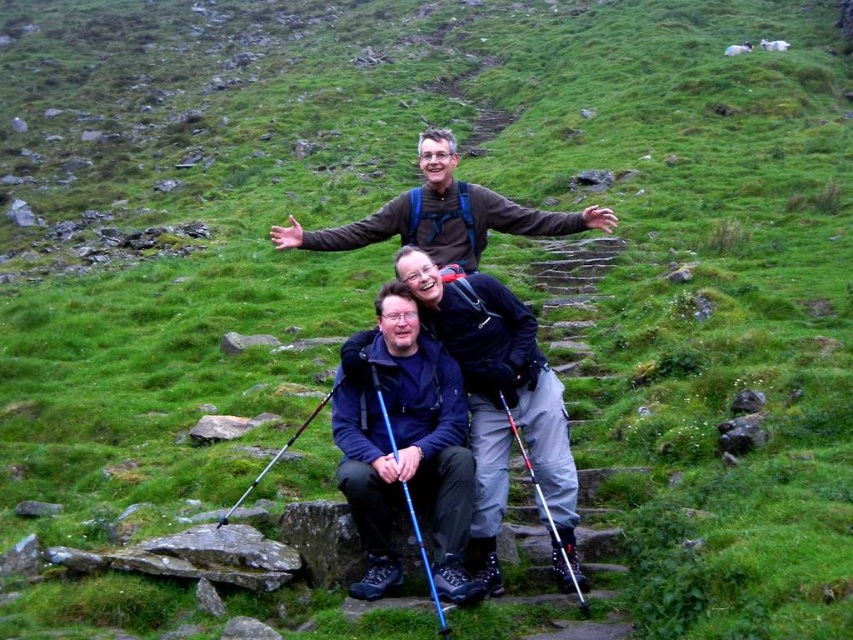
Is point (476, 417) farther from viewer compared to point (424, 248)?

No, (476, 417) is in front of (424, 248).

Find the location of a particular element. dark blue fabric jacket at center is located at coordinates (502, 406).

Where is `dark blue fabric jacket at center`? dark blue fabric jacket at center is located at coordinates (502, 406).